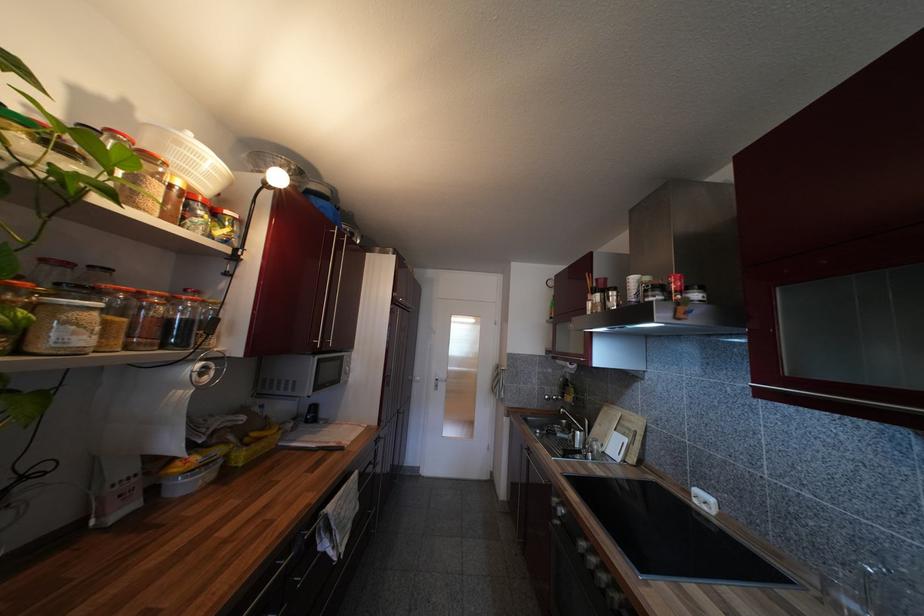
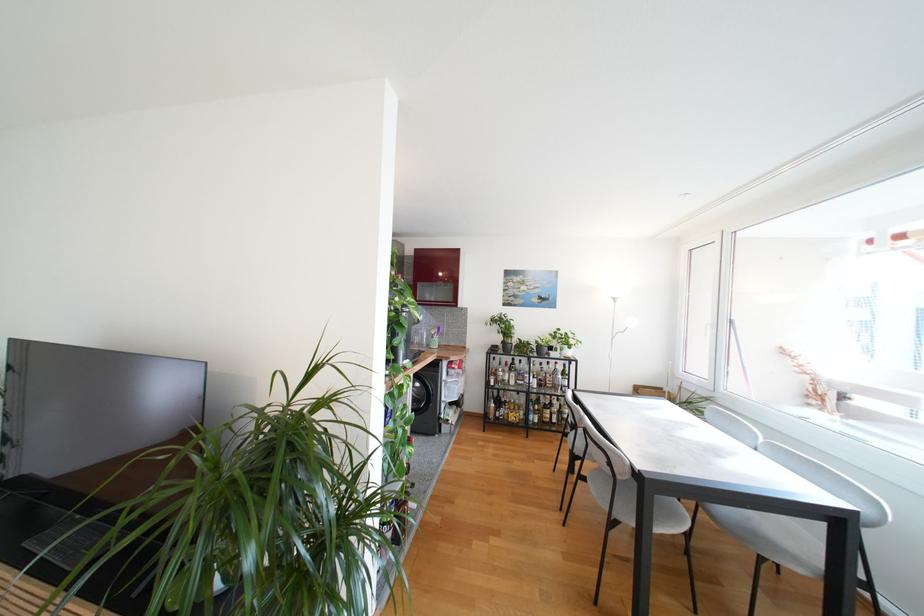
Question: I am providing you with two images of the same scene from different viewpoints. After the viewpoint changes to image2, which objects are now occluded?

Choices:
 (A) red capped pen
 (B) glass bottle
 (C) silver drawer handle
 (D) grey chair sitting surface

Answer: (C)